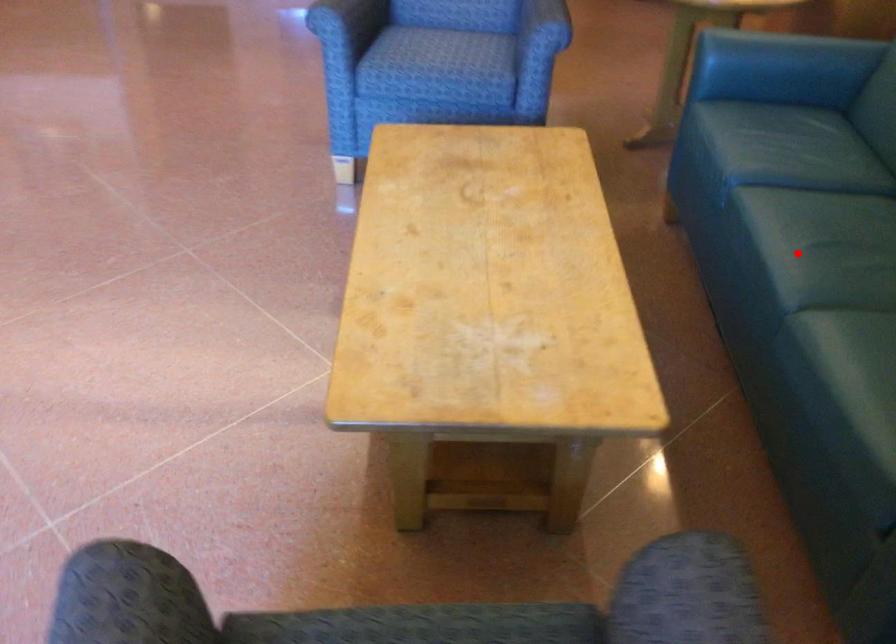
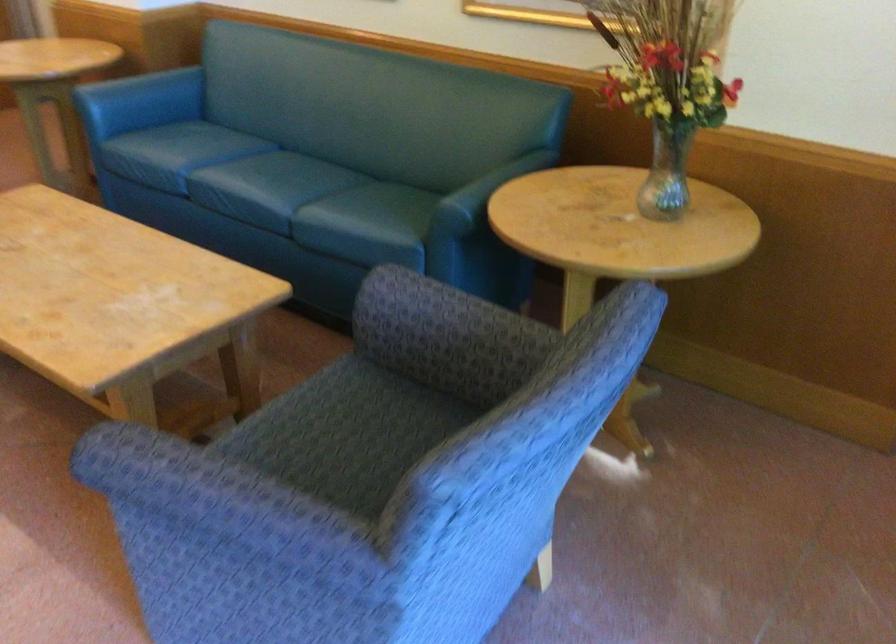
Question: I am providing you with two images of the same scene from different viewpoints. Given a red point in image1, look at the same physical point in image2. Is it:

Choices:
 (A) Closer to the viewpoint
 (B) Farther from the viewpoint

Answer: (B)